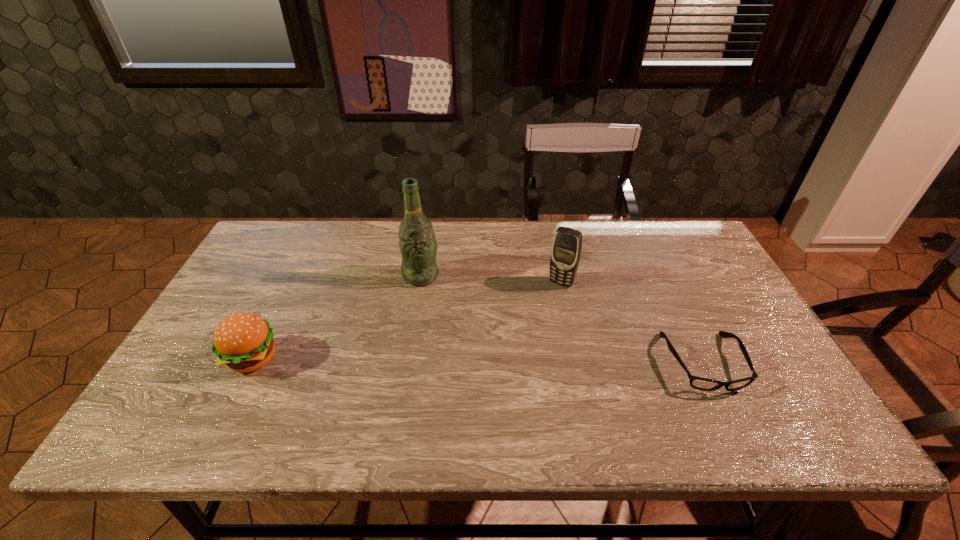
Where is `the third tallest object`? the third tallest object is located at coordinates (243, 341).

Where is `hamburger`? The height and width of the screenshot is (540, 960). hamburger is located at coordinates [x=243, y=341].

Locate an element on the screen. Image resolution: width=960 pixels, height=540 pixels. spectacles is located at coordinates (699, 383).

Where is `the rightmost object`? The height and width of the screenshot is (540, 960). the rightmost object is located at coordinates (699, 383).

The width and height of the screenshot is (960, 540). I want to click on the third object from right to left, so click(x=418, y=244).

I want to click on the tallest object, so click(418, 244).

You are a GUI agent. You are given a task and a screenshot of the screen. Output one action in this format:
    pyautogui.click(x=<x>, y=<y>)
    Task: Click on the second tallest object
    The image size is (960, 540).
    Given the screenshot: What is the action you would take?
    pyautogui.click(x=566, y=249)

At what (x,y) coordinates should I click in order to perform the action: click on cellular telephone. Please return your answer as a coordinate pair (x, y). Image resolution: width=960 pixels, height=540 pixels. Looking at the image, I should click on (566, 249).

The width and height of the screenshot is (960, 540). Find the location of `vacant space located on the right of the hamburger`. vacant space located on the right of the hamburger is located at coordinates (394, 359).

Locate an element on the screen. This screenshot has height=540, width=960. vacant region located 0.170m on the surface of the tallest object is located at coordinates (461, 321).